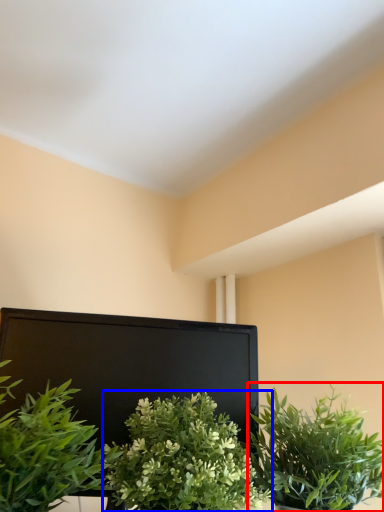
Question: Which point is further to the camera, houseplant (highlighted by a red box) or houseplant (highlighted by a blue box)?

Choices:
 (A) houseplant
 (B) houseplant

Answer: (A)